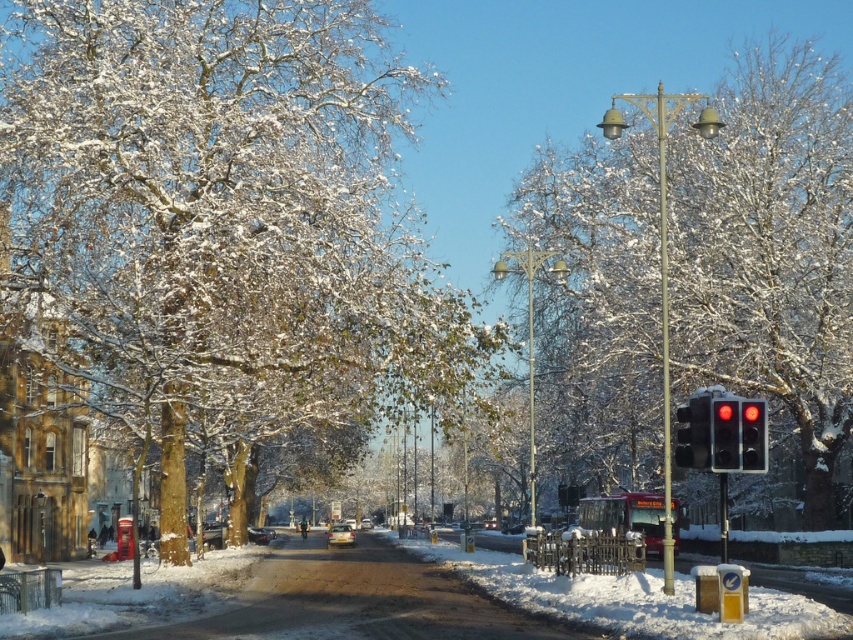
Which is above, black plastic traffic light at right or metallic red traffic light at right?

black plastic traffic light at right is above.

Can you confirm if black plastic traffic light at right is thinner than metallic red traffic light at right?

Incorrect, black plastic traffic light at right's width is not less than metallic red traffic light at right's.

Is point (689, 417) positioned behind point (727, 448)?

Yes, point (689, 417) is behind point (727, 448).

Locate an element on the screen. This screenshot has height=640, width=853. black plastic traffic light at right is located at coordinates (694, 432).

How much distance is there between metallic red traffic light at right and red glass traffic light at right?

metallic red traffic light at right and red glass traffic light at right are 8.84 inches apart.

Does metallic red traffic light at right have a greater width compared to red glass traffic light at right?

No.

This screenshot has width=853, height=640. Describe the element at coordinates (724, 435) in the screenshot. I see `metallic red traffic light at right` at that location.

You are a GUI agent. You are given a task and a screenshot of the screen. Output one action in this format:
    pyautogui.click(x=<x>, y=<y>)
    Task: Click on the metallic red traffic light at right
    This screenshot has width=853, height=640.
    Given the screenshot: What is the action you would take?
    pyautogui.click(x=724, y=435)

Is point (55, 106) positioned after point (682, 125)?

No, (55, 106) is closer to viewer.

Does snow-covered tree at center appear on the left side of snow-covered tree at right?

Yes, snow-covered tree at center is to the left of snow-covered tree at right.

Does point (93, 60) come in front of point (546, 444)?

Yes, point (93, 60) is closer to viewer.

Locate an element on the screen. This screenshot has width=853, height=640. snow-covered tree at center is located at coordinates (219, 220).